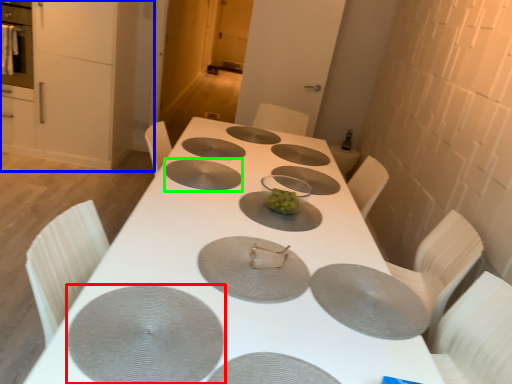
Question: Which object is positioned closest to pizza pan (highlighted by a red box)? Select from cabinetry (highlighted by a blue box) and pizza pan (highlighted by a green box).

Choices:
 (A) cabinetry
 (B) pizza pan

Answer: (B)